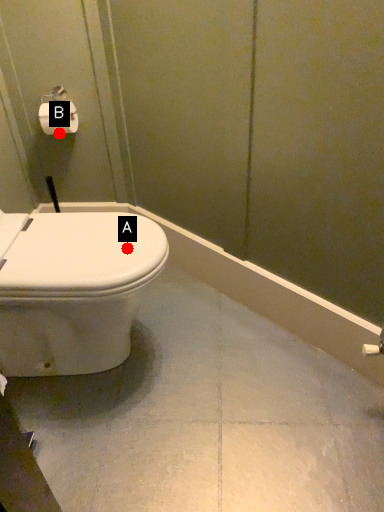
Question: Two points are circled on the image, labeled by A and B beside each circle. Which point is farther to the camera?

Choices:
 (A) A is further
 (B) B is further

Answer: (B)